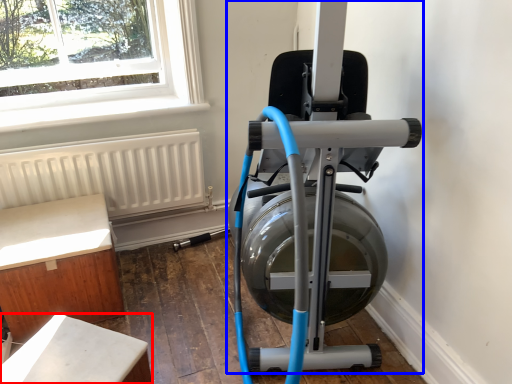
Question: Which object appears closest to the camera in this image, furniture (highlighted by a red box) or stationary bicycle (highlighted by a blue box)?

Choices:
 (A) furniture
 (B) stationary bicycle

Answer: (B)